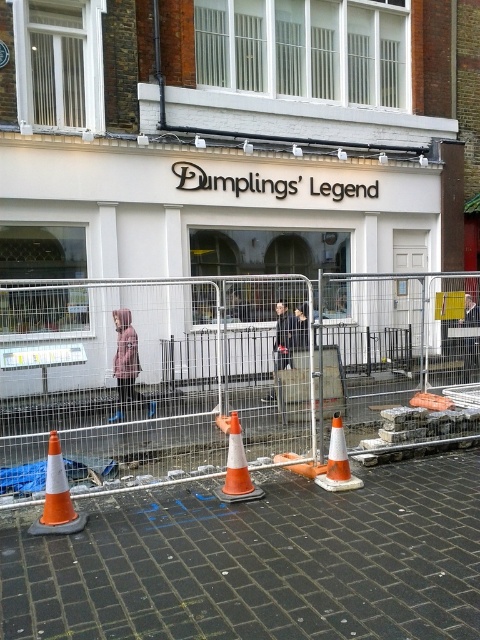
Is white matte sign at center positioned behind orange/white traffic cone at lower center?

Yes, it is.

The image size is (480, 640). Identify the location of white matte sign at center. (218, 209).

Does point (139, 449) come farther from viewer compared to point (271, 134)?

No, (139, 449) is in front of (271, 134).

At what (x,y) coordinates should I click in order to perform the action: click on metal fence at center. Please return your answer as a coordinate pair (x, y). The height and width of the screenshot is (640, 480). Looking at the image, I should click on pyautogui.click(x=232, y=376).

Who is more distant from viewer, (458, 296) or (439, 202)?

The point (439, 202) is behind.

This screenshot has width=480, height=640. I want to click on metal fence at center, so click(232, 376).

Between black brick pavement at lower center and white matte sign at center, which one is positioned lower?

black brick pavement at lower center is below.

Describe the element at coordinates (260, 563) in the screenshot. I see `black brick pavement at lower center` at that location.

Locate an element on the screen. Image resolution: width=480 pixels, height=640 pixels. black brick pavement at lower center is located at coordinates (260, 563).